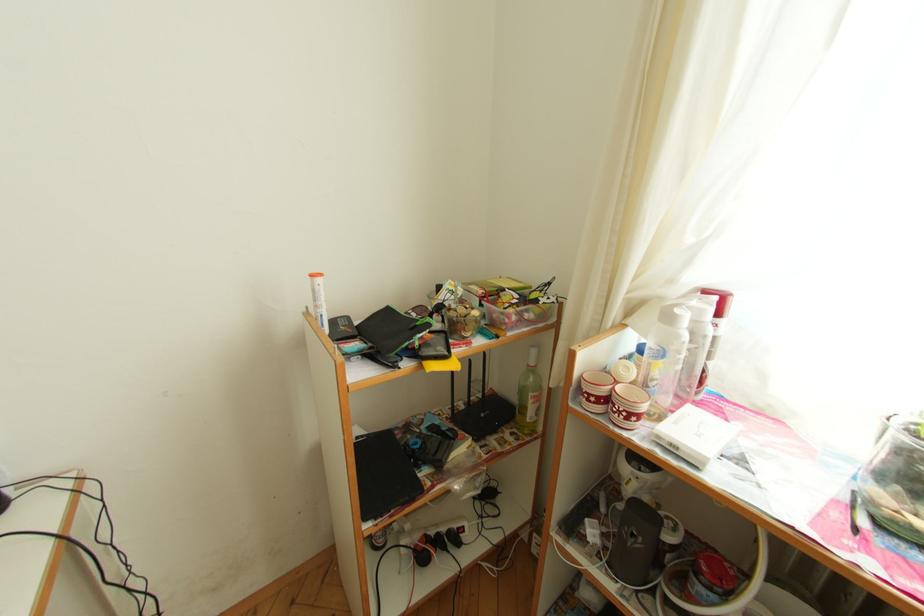
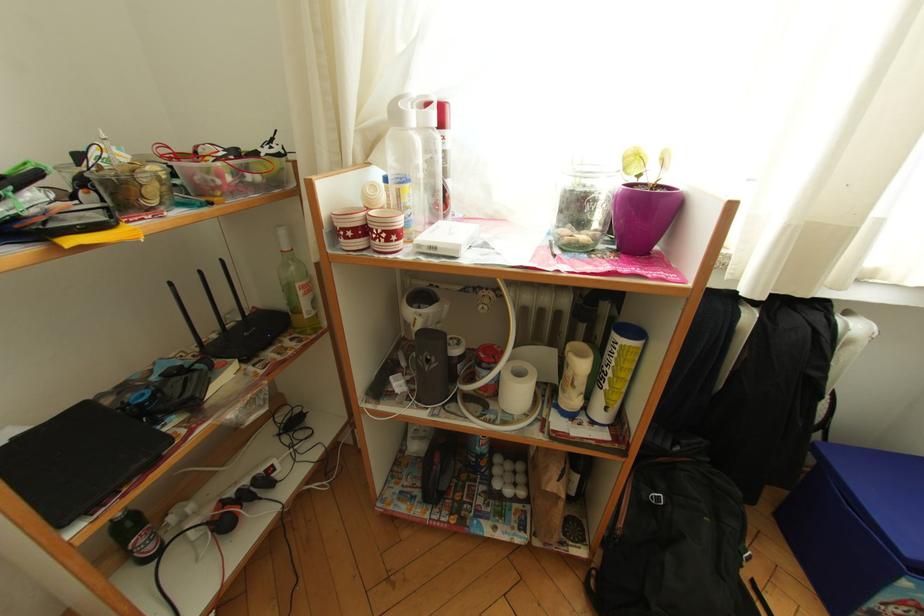
Question: The first image is from the beginning of the video and the second image is from the end. How did the camera likely rotate when shooting the video?

Choices:
 (A) Left
 (B) Right
 (C) Up
 (D) Down

Answer: (B)